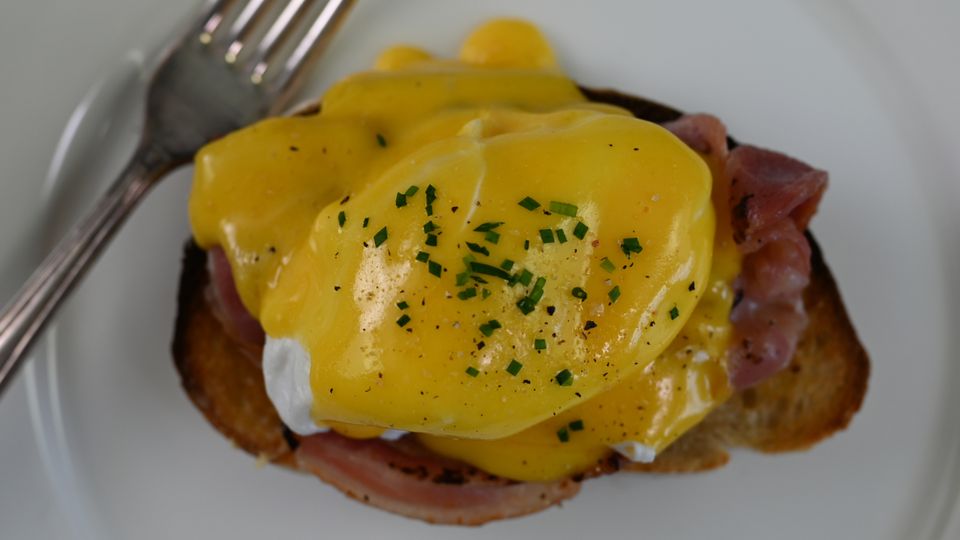
The width and height of the screenshot is (960, 540). I want to click on light reflection on fork and plate, so click(72, 124), click(248, 18).